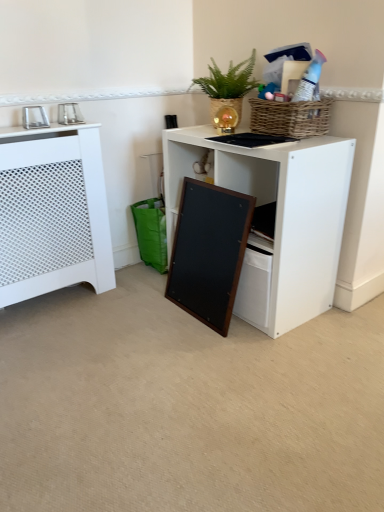
This screenshot has height=512, width=384. In order to click on empty space that is in between white perforated radiator at left and white matte desk at center in this screenshot , I will do `click(127, 314)`.